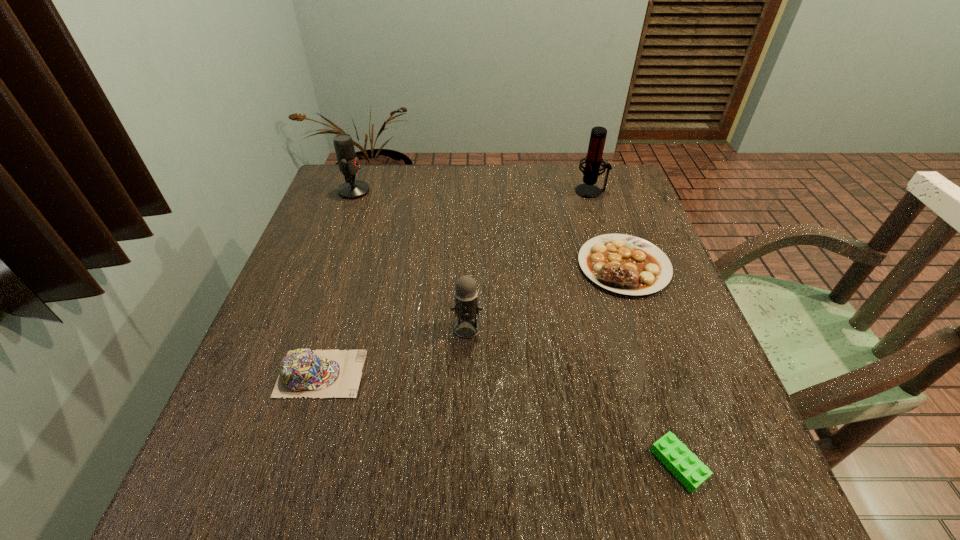
This screenshot has height=540, width=960. Identify the location of free space at the near left corner of the desktop. (236, 512).

Identify the location of vacant space at the far right corner of the desktop. (612, 185).

Identify the location of vacant region between the leftmost microphone and the third object from left to right. (411, 259).

Identify the location of free space between the leftmost microphone and the rightmost microphone. (472, 191).

Image resolution: width=960 pixels, height=540 pixels. What are the coordinates of `vacant space that is in between the leftmost microphone and the fourth object from right to left` in the screenshot? It's located at (411, 259).

Locate an element on the screen. free area in between the Lego and the fifth farthest object is located at coordinates (500, 418).

Image resolution: width=960 pixels, height=540 pixels. Find the location of `free spot between the shortest object and the fourth farthest object`. free spot between the shortest object and the fourth farthest object is located at coordinates (573, 396).

At what (x,y) coordinates should I click in order to perform the action: click on vacant area that lies between the rightmost microphone and the leftmost microphone. Please return your answer as a coordinate pair (x, y). The width and height of the screenshot is (960, 540). Looking at the image, I should click on (472, 191).

Where is `vacant space that is in between the third object from left to right and the leftmost microphone`? vacant space that is in between the third object from left to right and the leftmost microphone is located at coordinates (411, 259).

Locate an element on the screen. This screenshot has height=540, width=960. free space between the fifth farthest object and the leftmost microphone is located at coordinates (338, 282).